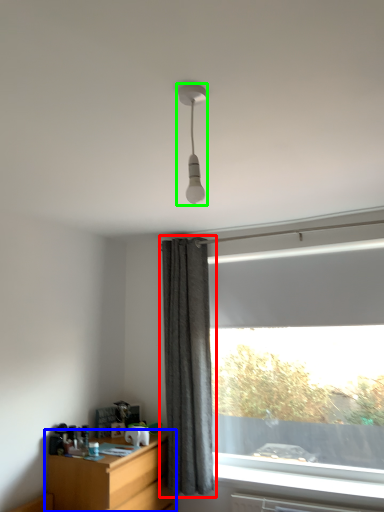
Question: Which is nearer to the curtain (highlighted by a red box)? desk (highlighted by a blue box) or lamp (highlighted by a green box).

Choices:
 (A) desk
 (B) lamp

Answer: (A)